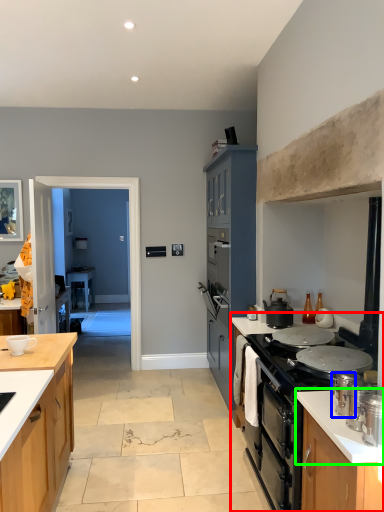
Question: Based on their relative distances, which object is nearer to countertop (highlighted by a red box)? Choose from kitchen appliance (highlighted by a blue box) and countertop (highlighted by a green box).

Choices:
 (A) kitchen appliance
 (B) countertop

Answer: (B)